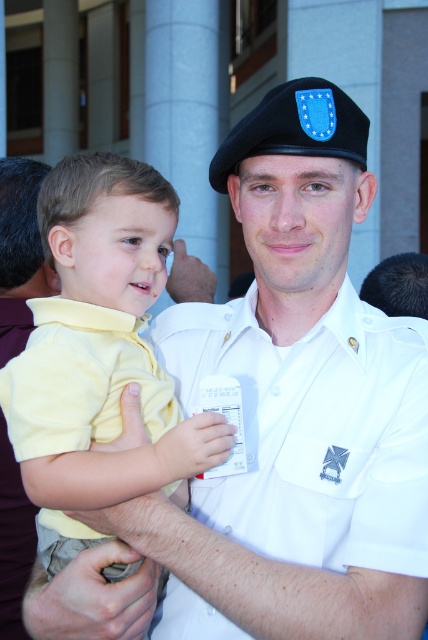
Does point (259, 438) come closer to viewer compared to point (127, 237)?

No.

Between white cotton shirt at center and yellow matte shirt at center, which one has less height?

white cotton shirt at center is shorter.

Is point (383, 564) farther from viewer compared to point (142, 230)?

That is False.

Where is `white cotton shirt at center`? white cotton shirt at center is located at coordinates (314, 429).

Can you confirm if white cotton shirt at center is smaller than yellow cotton shirt at center?

Incorrect, white cotton shirt at center is not smaller in size than yellow cotton shirt at center.

Looking at this image, who is more distant from viewer, (380,355) or (83,326)?

Positioned behind is point (380,355).

Is point (210, 518) positioned in front of point (154, 410)?

That is False.

At what (x,y) coordinates should I click in order to perform the action: click on white cotton shirt at center. Please return your answer as a coordinate pair (x, y). This screenshot has height=640, width=428. Looking at the image, I should click on (314, 429).

Does yellow matte shirt at center have a smaller size compared to yellow cotton shirt at center?

Actually, yellow matte shirt at center might be larger than yellow cotton shirt at center.

Is point (158, 227) positioned behind point (109, 388)?

Yes, point (158, 227) is farther from viewer.

Identify the location of yellow matte shirt at center. This screenshot has height=640, width=428. (107, 433).